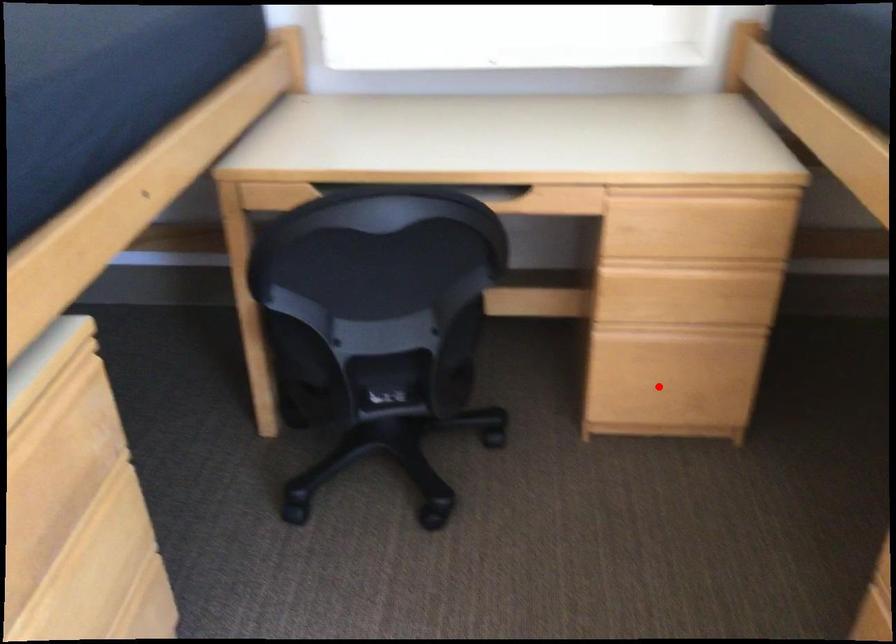
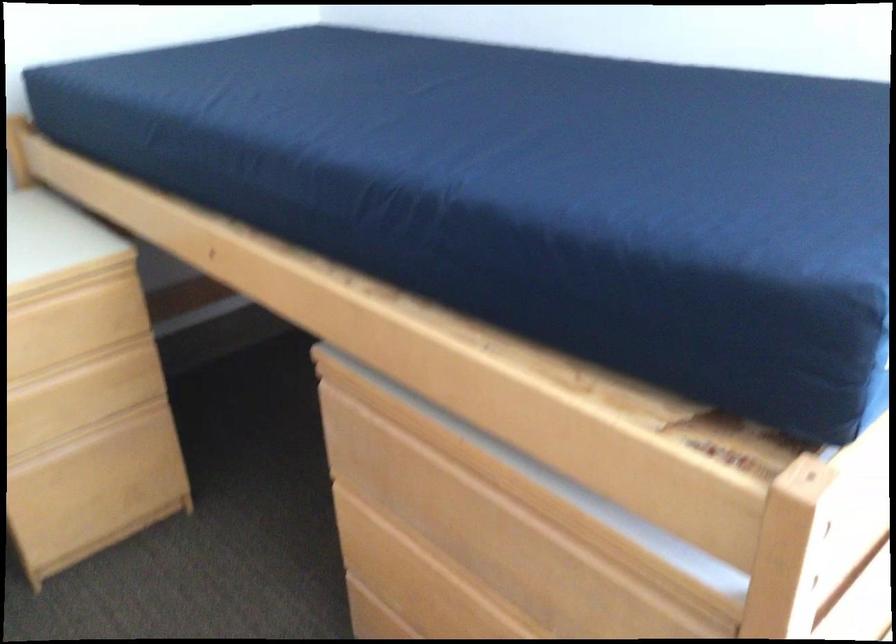
Where in the second image is the point corresponding to the highlighted location from the first image?

(97, 495)